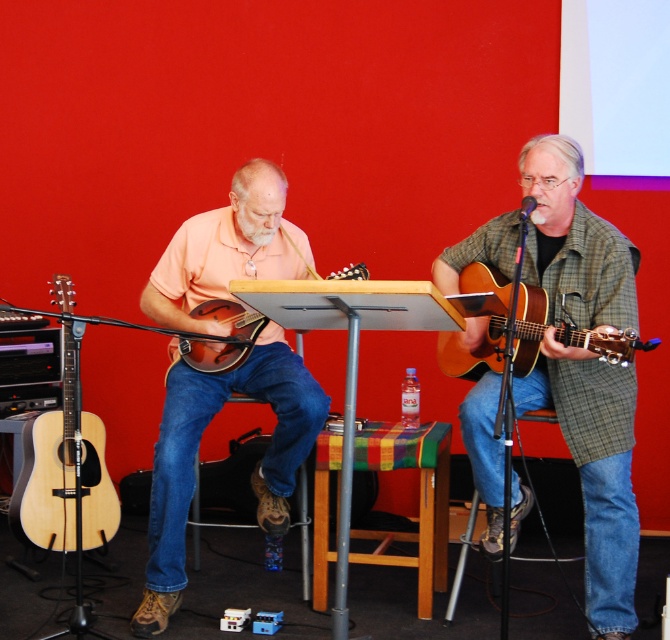
Question: Which object is farther from the camera taking this photo?

Choices:
 (A) matte orange mandolin at left
 (B) matte brown acoustic guitar at center

Answer: (A)

Question: Can you confirm if matte orange mandolin at left is smaller than natural wood acoustic guitar at left?

Choices:
 (A) no
 (B) yes

Answer: (B)

Question: Considering the real-world distances, which object is farthest from the matte orange mandolin at left?

Choices:
 (A) green plaid shirt at center
 (B) matte brown acoustic guitar at center
 (C) acoustic wood guitar at right

Answer: (A)

Question: Estimate the real-world distances between objects in this image. Which object is farther from the acoustic wood guitar at right?

Choices:
 (A) matte orange mandolin at left
 (B) green plaid shirt at center
 (C) matte brown acoustic guitar at center
 (D) natural wood acoustic guitar at left

Answer: (D)

Question: Considering the relative positions of green plaid shirt at center and matte orange mandolin at left in the image provided, where is green plaid shirt at center located with respect to matte orange mandolin at left?

Choices:
 (A) above
 (B) below

Answer: (A)

Question: Can you confirm if green plaid shirt at center is positioned to the right of acoustic wood guitar at right?

Choices:
 (A) no
 (B) yes

Answer: (B)